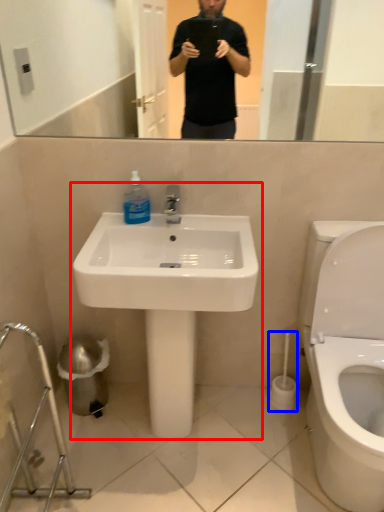
Question: Which object appears closest to the camera in this image, sink (highlighted by a red box) or brush (highlighted by a blue box)?

Choices:
 (A) sink
 (B) brush

Answer: (A)